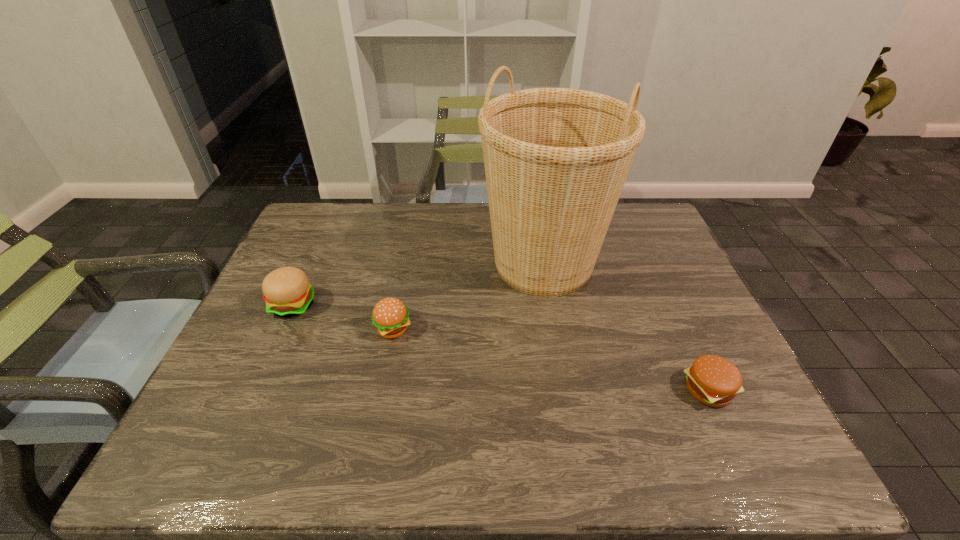
Identify which object is located as the third nearest to the leftmost object. Please provide its 2D coordinates. Your answer should be formatted as a tuple, i.e. [(x, y)], where the tuple contains the x and y coordinates of a point satisfying the conditions above.

[(714, 381)]

At what (x,y) coordinates should I click in order to perform the action: click on object that is the closest to the leftmost object. Please return your answer as a coordinate pair (x, y). This screenshot has height=540, width=960. Looking at the image, I should click on (390, 316).

Identify which hamburger is the closest to the shortest hamburger. Please provide its 2D coordinates. Your answer should be formatted as a tuple, i.e. [(x, y)], where the tuple contains the x and y coordinates of a point satisfying the conditions above.

[(390, 316)]

In order to click on hamburger that can be found as the third closest to the basket in this screenshot , I will do `click(287, 292)`.

I want to click on free space that satisfies the following two spatial constraints: 1. on the back side of the second hamburger from left to right; 2. on the right side of the basket, so click(406, 264).

Where is `free space that satisfies the following two spatial constraints: 1. on the front side of the leftmost object; 2. on the left side of the shortest hamburger`? Image resolution: width=960 pixels, height=540 pixels. free space that satisfies the following two spatial constraints: 1. on the front side of the leftmost object; 2. on the left side of the shortest hamburger is located at coordinates (255, 390).

This screenshot has height=540, width=960. In order to click on free space that satisfies the following two spatial constraints: 1. on the front side of the second shortest hamburger; 2. on the right side of the shortest hamburger in this screenshot , I will do `click(381, 390)`.

Locate an element on the screen. Image resolution: width=960 pixels, height=540 pixels. free spot that satisfies the following two spatial constraints: 1. on the back side of the second object from left to right; 2. on the left side of the third object from left to right is located at coordinates (406, 264).